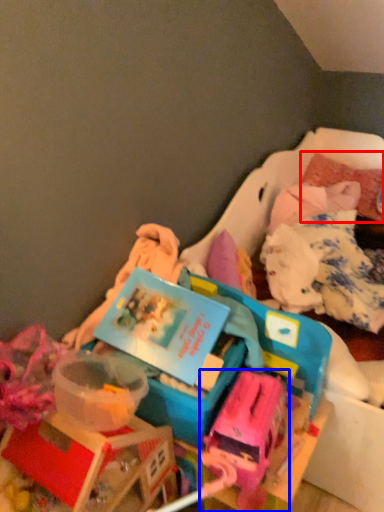
Question: Which object appears farthest to the camera in this image, pillow (highlighted by a red box) or toy (highlighted by a blue box)?

Choices:
 (A) pillow
 (B) toy

Answer: (A)